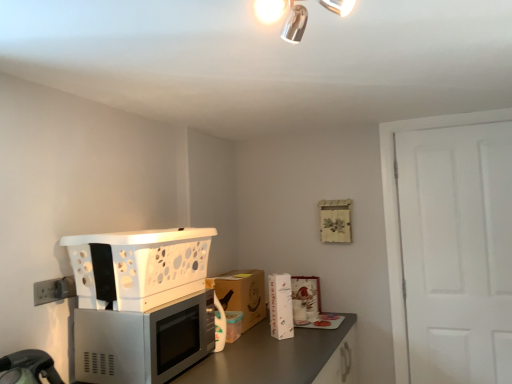
The image size is (512, 384). I want to click on empty space that is to the right of white glossy refrigerator at center, which ranks as the 1th appliance in left-to-right order, so click(312, 333).